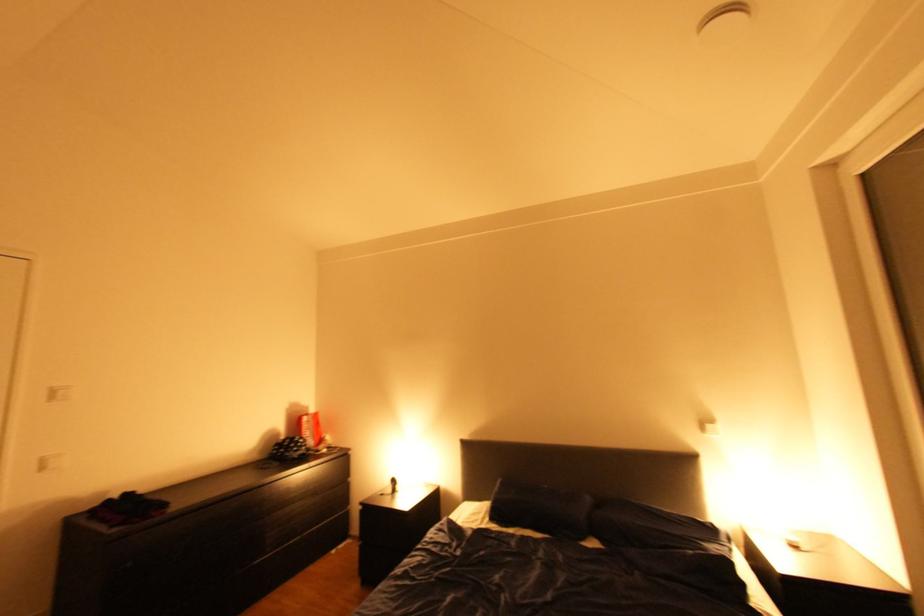
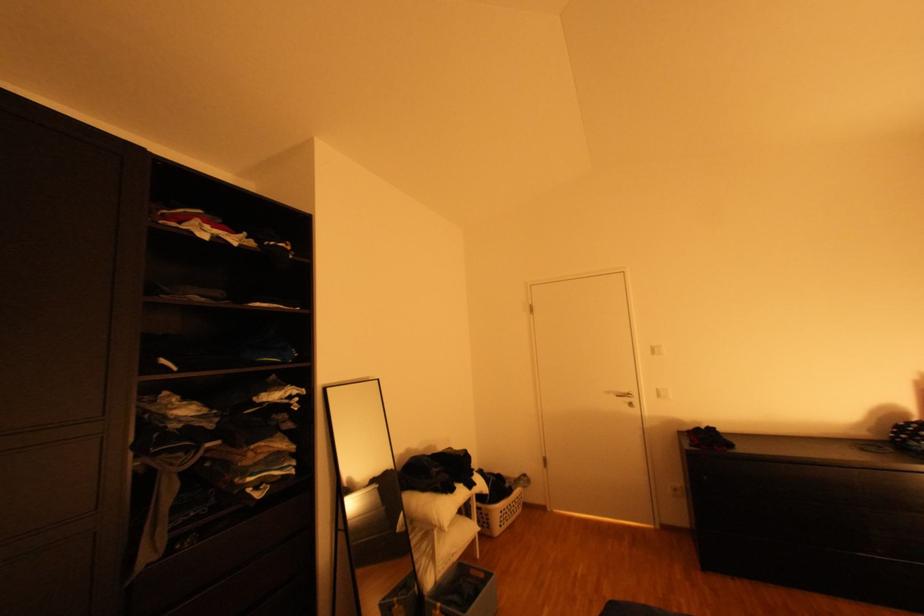
Question: The camera is either moving clockwise (left) or counter-clockwise (right) around the object. The first image is from the beginning of the video and the second image is from the end. Is the camera moving left or right when shooting the video?

Choices:
 (A) Left
 (B) Right

Answer: (B)